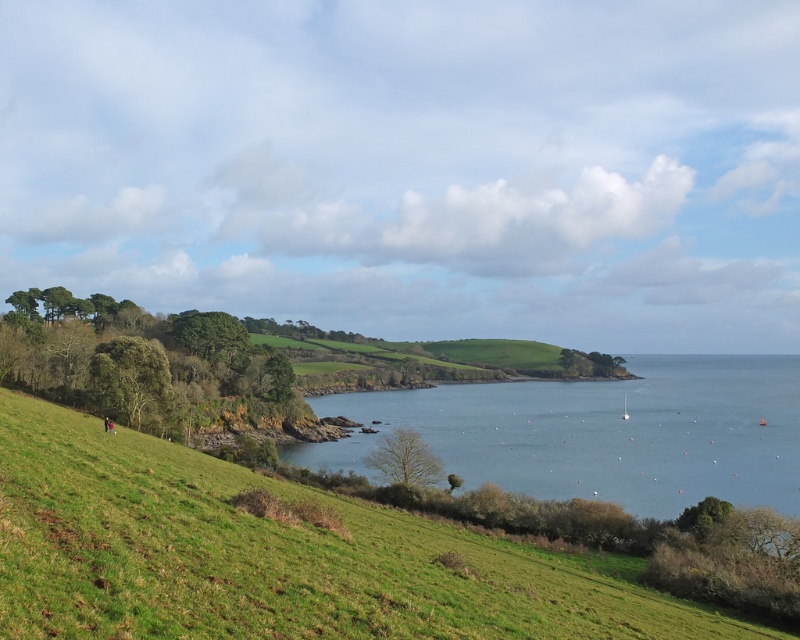
Based on the photo, you are standing on the green grassy hillside at lower left and want to walk to the blue water at center. Which direction should you head?

You should head to the right because the green grassy hillside at lower left is to the left of the blue water at center, so moving right will take you towards the water.

You are standing on the green grassy hillside at lower left and want to reach the blue water at center. Which direction should you walk to get there?

You should walk downward from the green grassy hillside at lower left to reach the blue water at center since the hillside is above the water.